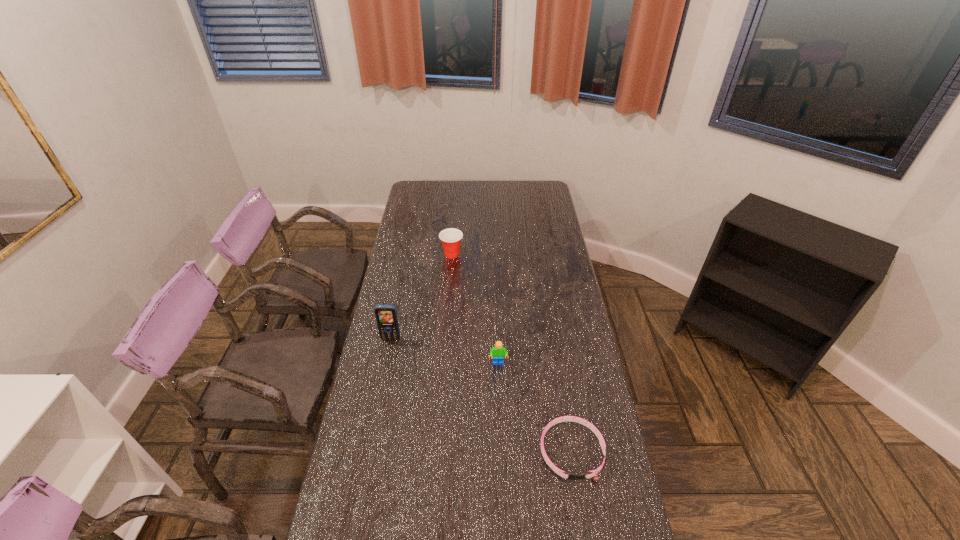
This screenshot has width=960, height=540. I want to click on the tallest object, so click(386, 315).

Where is `cellular telephone`? The image size is (960, 540). cellular telephone is located at coordinates (386, 315).

What are the coordinates of `cup` in the screenshot? It's located at (451, 237).

Locate an element on the screen. the farthest object is located at coordinates (451, 237).

The width and height of the screenshot is (960, 540). What are the coordinates of `Lego` in the screenshot? It's located at (498, 352).

Find the location of a particular element. This screenshot has width=960, height=540. the second nearest object is located at coordinates (498, 352).

Image resolution: width=960 pixels, height=540 pixels. Find the location of `the rightmost object`. the rightmost object is located at coordinates (573, 476).

Find the location of `the shortest object`. the shortest object is located at coordinates (573, 476).

This screenshot has width=960, height=540. I want to click on vacant point located on the screen of the leftmost object, so click(x=379, y=397).

Identify the location of free space located on the left of the second object from left to right. Image resolution: width=960 pixels, height=540 pixels. (403, 255).